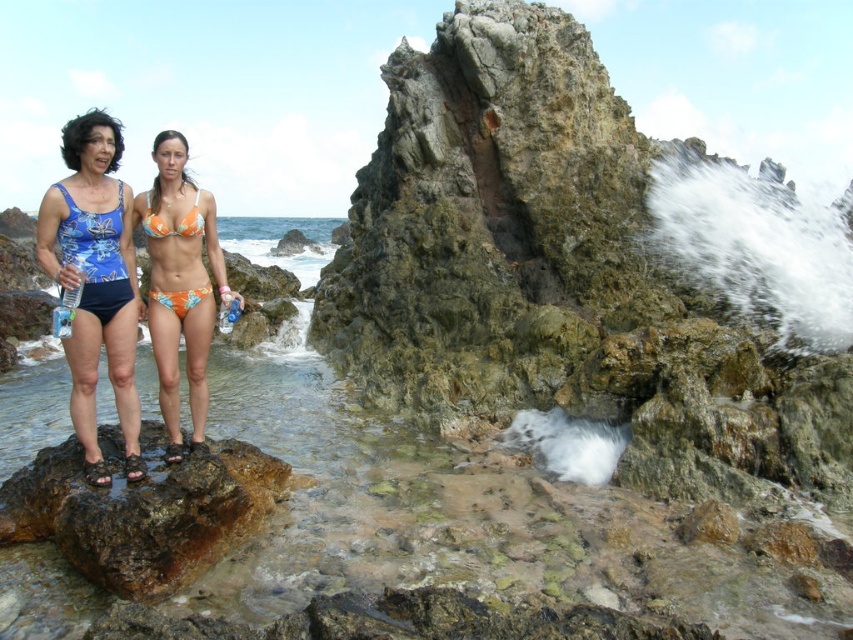
Identify the location of brown rough rock at lower left. The height and width of the screenshot is (640, 853). (142, 515).

Which of these two, brown rough rock at lower left or blue printed fabric bikini at left, stands shorter?

brown rough rock at lower left is shorter.

Describe the element at coordinates (142, 515) in the screenshot. I see `brown rough rock at lower left` at that location.

The image size is (853, 640). What are the coordinates of `brown rough rock at lower left` in the screenshot? It's located at (142, 515).

Is brown rough rock at lower left taller than blue fabric swimsuit at left?

Yes, brown rough rock at lower left is taller than blue fabric swimsuit at left.

Which is in front, point (229, 444) or point (115, 388)?

Positioned in front is point (115, 388).

I want to click on brown rough rock at lower left, so click(x=142, y=515).

Which of these two, brown rough rock at lower left or orange floral bikini at center, stands taller?

Standing taller between the two is brown rough rock at lower left.

Is brown rough rock at lower left thinner than orange floral bikini at center?

No, brown rough rock at lower left is not thinner than orange floral bikini at center.

Describe the element at coordinates (142, 515) in the screenshot. I see `brown rough rock at lower left` at that location.

This screenshot has width=853, height=640. Find the location of `brown rough rock at lower left`. brown rough rock at lower left is located at coordinates (142, 515).